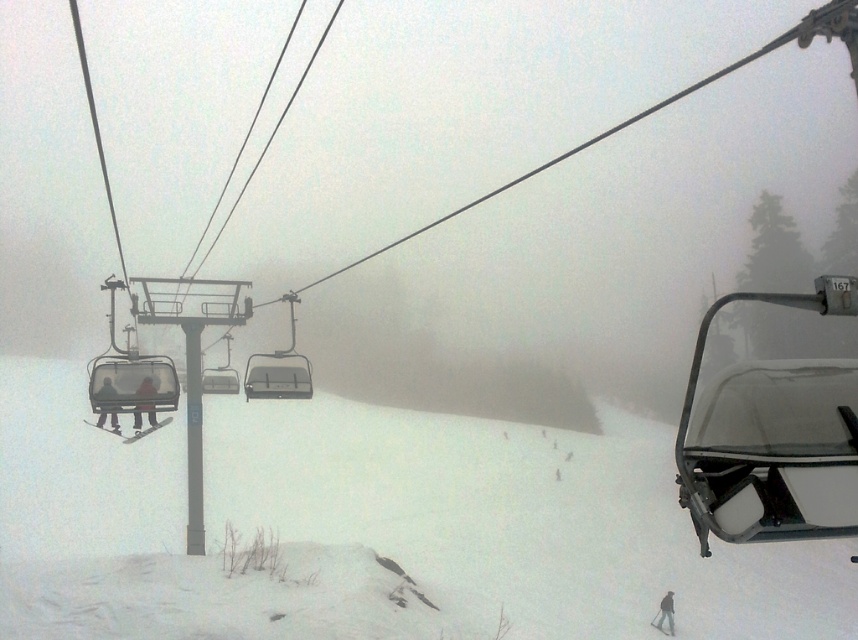
You are standing at point (219, 380) in the snowy ski resort scene. What object is exactly at your current location?

The metallic gray chairlift at center is exactly at point (219, 380).

You are a skier who just arrived at the resort and want to check your equipment before boarding the chairlift. You have a white matte ski at lower center. Where should you place it relative to the metallic gray chairlift at center to ensure it doesn not get in the way of the ski lift operations?

Place the white matte ski at lower center to the right of the metallic gray chairlift at center, as the chairlift is currently positioned to the left of the ski. This placement will keep the ski out of the operational path of the chairlift.